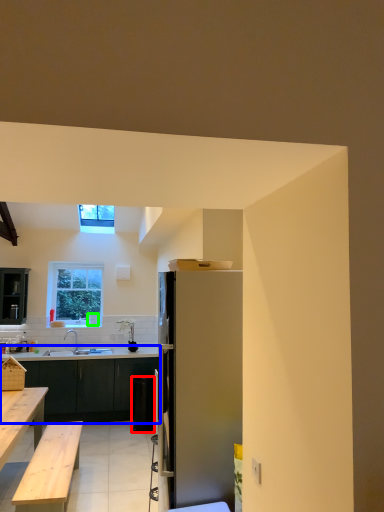
Question: Which is farther away from trash bin/can (highlighted by a red box)? kitchen & dining room table (highlighted by a blue box) or coffee cup (highlighted by a green box)?

Choices:
 (A) kitchen & dining room table
 (B) coffee cup

Answer: (B)